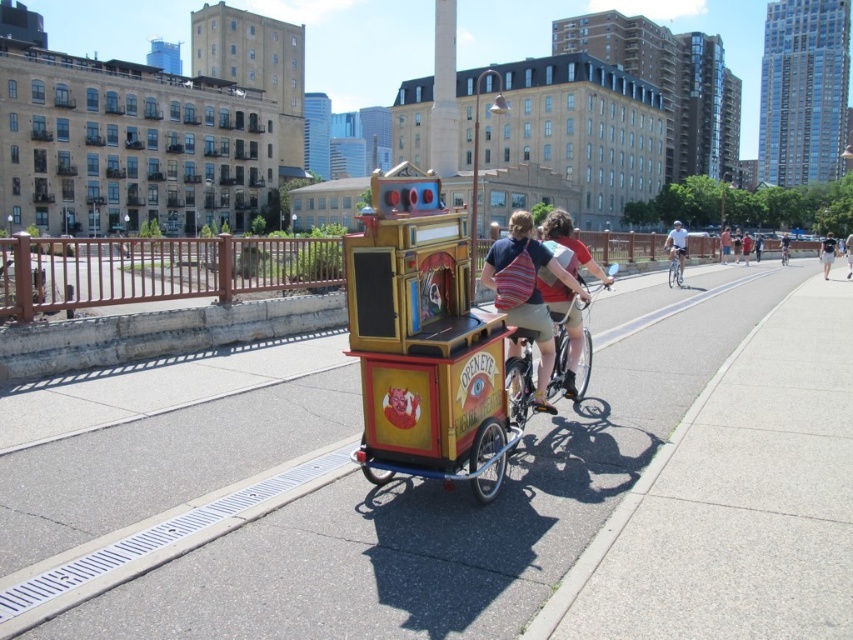
You are a delivery robot that needs to pass between the silver metallic bicycle at center and the red cotton shirt at center. Your robot is 1.5 meters wide. Can you safely navigate through the space between them?

The distance between the silver metallic bicycle at center and the red cotton shirt at center is 31.26 meters, so yes, the robot can safely navigate through the space since the distance is much wider than the robot.

You are standing at the point with coordinates point [728,257] and want to walk towards the point [822,252]. According to the scene, will you be moving forward or backward relative to the pedicab?

Since point [822,252] is in front of point [728,257], moving towards it would mean moving forward relative to the pedicab.